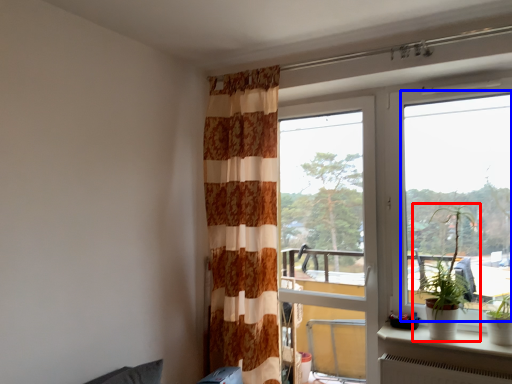
Question: Which point is closer to the camera, houseplant (highlighted by a red box) or window (highlighted by a blue box)?

Choices:
 (A) houseplant
 (B) window

Answer: (B)